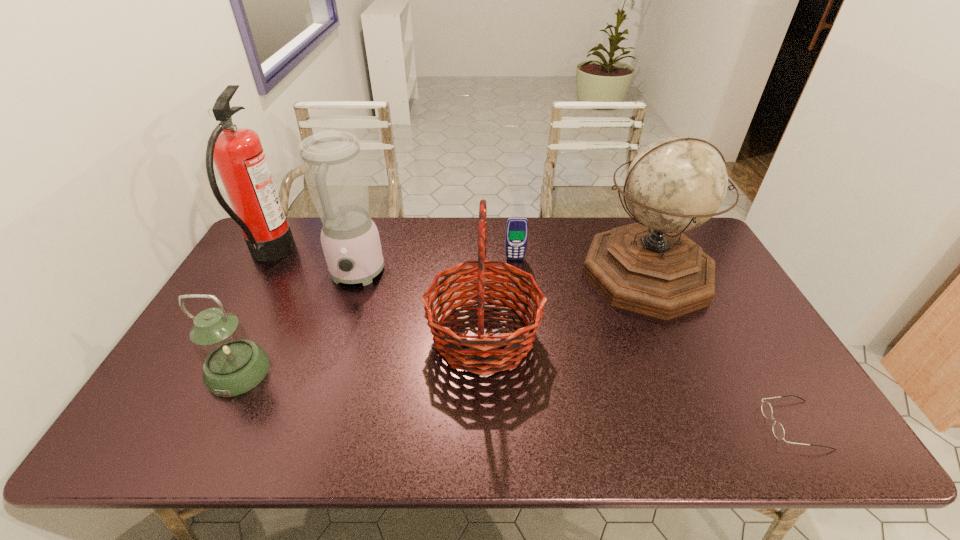
Identify the location of unoccupied area between the globe and the shortest object. (720, 349).

The width and height of the screenshot is (960, 540). In order to click on empty space between the basket and the food processor in this screenshot , I will do `click(420, 306)`.

Find the location of a particular element. Image resolution: width=960 pixels, height=540 pixels. empty location between the basket and the food processor is located at coordinates (420, 306).

This screenshot has height=540, width=960. I want to click on object that is the fourth closest to the food processor, so 517,227.

Image resolution: width=960 pixels, height=540 pixels. In order to click on object that stands as the second closest to the basket in this screenshot , I will do `click(332, 162)`.